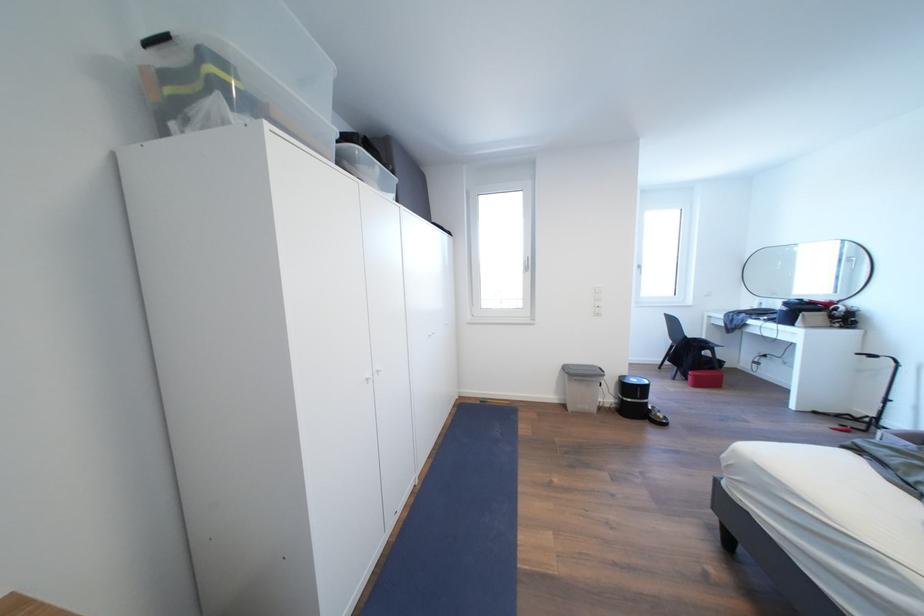
Find where to pull the white window handle. Please return your answer as a coordinate pair (x, y).

(528, 264)